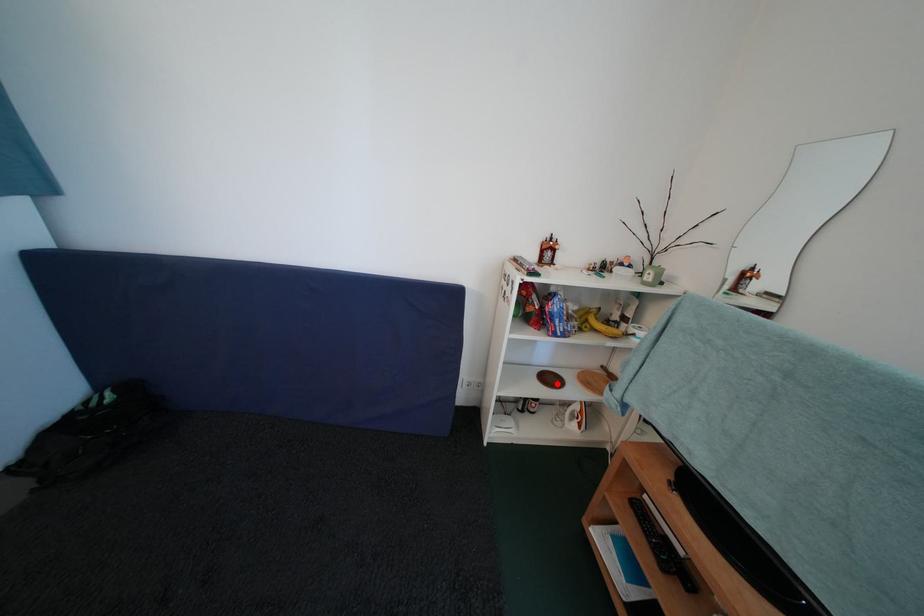
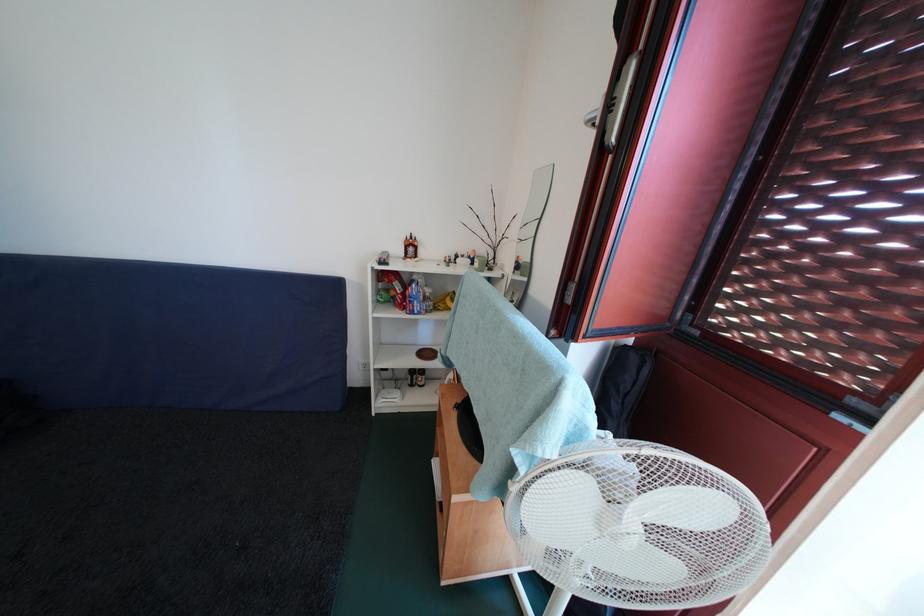
In the second image, find the point that corresponds to the highlighted location in the first image.

(433, 359)